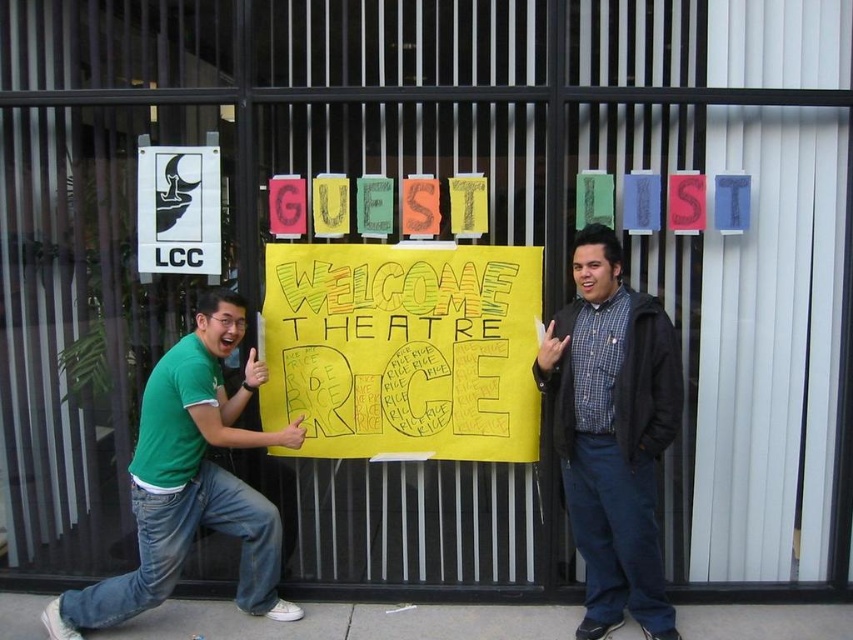
Question: Which object appears closest to the camera in this image?

Choices:
 (A) yellow paper sign at center
 (B) white paper at upper left
 (C) plaid shirt at center

Answer: (C)

Question: Does yellow paper sign at center appear over green t-shirt at left?

Choices:
 (A) no
 (B) yes

Answer: (B)

Question: Which object is farther from the camera taking this photo?

Choices:
 (A) white paper at upper left
 (B) green t-shirt at left

Answer: (A)

Question: Is plaid shirt at center in front of green t-shirt at left?

Choices:
 (A) no
 (B) yes

Answer: (B)

Question: Which object is positioned farthest from the white paper at upper left?

Choices:
 (A) yellow paper sign at center
 (B) green t-shirt at left
 (C) plaid shirt at center

Answer: (C)

Question: Does yellow paper sign at center have a larger size compared to green t-shirt at left?

Choices:
 (A) no
 (B) yes

Answer: (A)